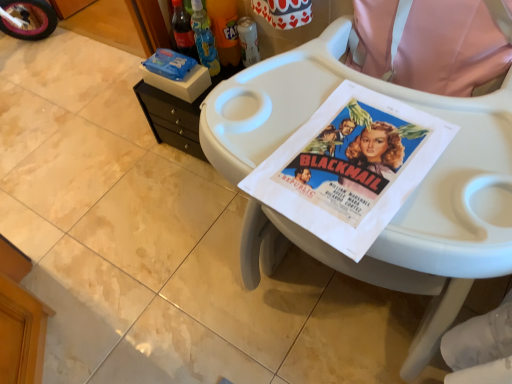
Question: Considering the relative sizes of black plastic changing table at upper left and translucent plastic bottle at upper center, which appears as the second bottle when viewed from the right, in the image provided, is black plastic changing table at upper left wider than translucent plastic bottle at upper center, which appears as the second bottle when viewed from the right,?

Choices:
 (A) no
 (B) yes

Answer: (B)

Question: From a real-world perspective, is black plastic changing table at upper left located higher than translucent plastic bottle at upper center, which appears as the second bottle when viewed from the right?

Choices:
 (A) no
 (B) yes

Answer: (A)

Question: From the image's perspective, is black plastic changing table at upper left above translucent plastic bottle at upper center, which appears as the second bottle when viewed from the right?

Choices:
 (A) yes
 (B) no

Answer: (B)

Question: Is black plastic changing table at upper left far from translucent plastic bottle at upper center, which appears as the second bottle when viewed from the right?

Choices:
 (A) yes
 (B) no

Answer: (B)

Question: Is black plastic changing table at upper left shorter than translucent plastic bottle at upper center, which appears as the second bottle when viewed from the right?

Choices:
 (A) yes
 (B) no

Answer: (A)

Question: Considering their positions, is metallic can at center, the first bottle in the right-to-left sequence, located in front of or behind translucent plastic bottle at upper center, the 3th bottle from the right?

Choices:
 (A) front
 (B) behind

Answer: (B)

Question: Does point (251, 57) appear closer or farther from the camera than point (195, 26)?

Choices:
 (A) farther
 (B) closer

Answer: (A)

Question: From the image's perspective, is metallic can at center, acting as the 3th bottle starting from the left, located above or below translucent plastic bottle at upper center, the 3th bottle from the right?

Choices:
 (A) above
 (B) below

Answer: (B)

Question: In the image, is metallic can at center, the first bottle in the right-to-left sequence, on the left side or the right side of translucent plastic bottle at upper center, the 3th bottle from the right?

Choices:
 (A) right
 (B) left

Answer: (A)

Question: Based on their sizes in the image, would you say translucent plastic bottle at upper center, the 3th bottle from the right, is bigger or smaller than translucent plastic bottle at upper center, the 2th bottle positioned from the left?

Choices:
 (A) big
 (B) small

Answer: (B)

Question: Considering the positions of translucent plastic bottle at upper center, the 3th bottle from the right, and translucent plastic bottle at upper center, the 2th bottle positioned from the left, in the image, is translucent plastic bottle at upper center, the 3th bottle from the right, wider or thinner than translucent plastic bottle at upper center, the 2th bottle positioned from the left,?

Choices:
 (A) thin
 (B) wide

Answer: (A)

Question: Is translucent plastic bottle at upper center, the 3th bottle from the right, taller or shorter than translucent plastic bottle at upper center, the 2th bottle positioned from the left?

Choices:
 (A) short
 (B) tall

Answer: (A)

Question: From the image's perspective, is translucent plastic bottle at upper center, the first bottle from the left, above or below translucent plastic bottle at upper center, the 2th bottle positioned from the left?

Choices:
 (A) below
 (B) above

Answer: (A)

Question: Is white glossy tile at lower left spatially inside black plastic changing table at upper left, or outside of it?

Choices:
 (A) outside
 (B) inside

Answer: (A)

Question: In terms of width, does white glossy tile at lower left look wider or thinner when compared to black plastic changing table at upper left?

Choices:
 (A) thin
 (B) wide

Answer: (A)